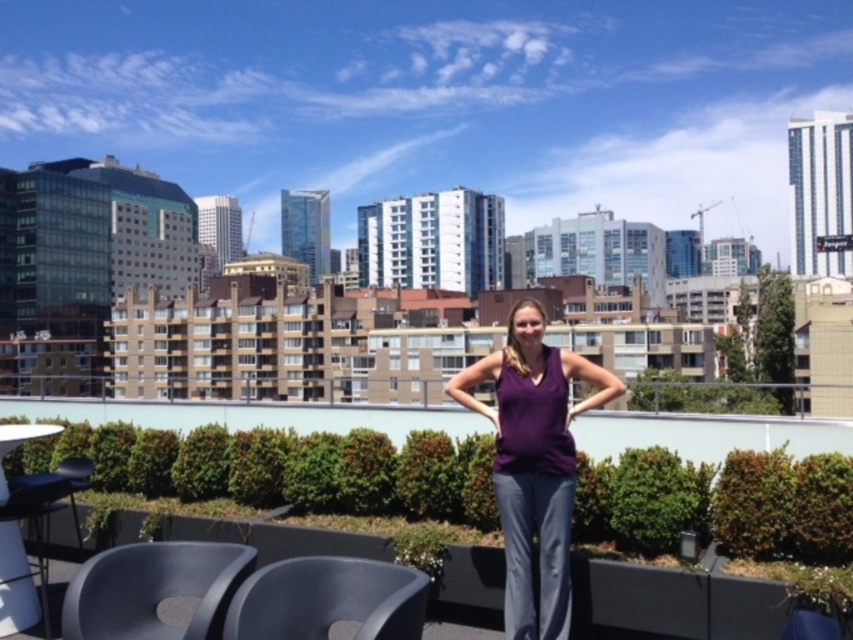
Can you confirm if matte black chair at lower left is taller than black plastic chair at lower center?

Correct, matte black chair at lower left is much taller as black plastic chair at lower center.

Between matte black chair at lower left and black plastic chair at lower center, which one has less height?

black plastic chair at lower center is shorter.

Is point (242, 580) positioned in front of point (372, 572)?

No.

Find the location of `matte black chair at lower left`. matte black chair at lower left is located at coordinates (154, 589).

Which is above, purple matte tank top at center or matte black chair at lower left?

purple matte tank top at center is above.

Does purple matte tank top at center have a smaller size compared to matte black chair at lower left?

No.

Is point (527, 627) more distant than point (109, 548)?

No.

Identify the location of purple matte tank top at center. This screenshot has width=853, height=640. (534, 464).

Is purple matte tank top at center shorter than black plastic chair at lower center?

No, purple matte tank top at center is not shorter than black plastic chair at lower center.

Does purple matte tank top at center appear under black plastic chair at lower center?

Incorrect, purple matte tank top at center is not positioned below black plastic chair at lower center.

This screenshot has width=853, height=640. Identify the location of purple matte tank top at center. (534, 464).

At what (x,y) coordinates should I click in order to perform the action: click on purple matte tank top at center. Please return your answer as a coordinate pair (x, y). The image size is (853, 640). Looking at the image, I should click on (534, 464).